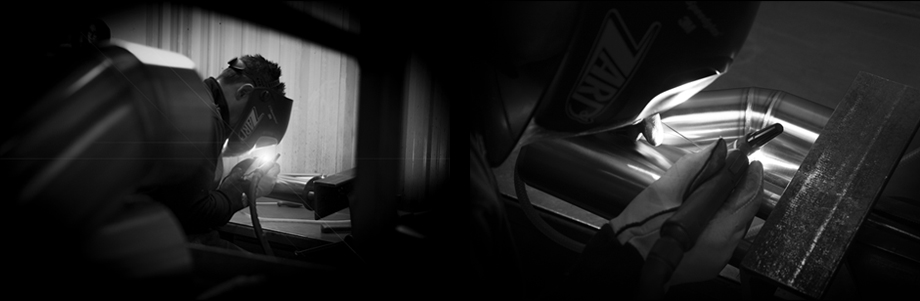
The image size is (920, 301). In order to click on cord in this screenshot , I will do `click(677, 225)`.